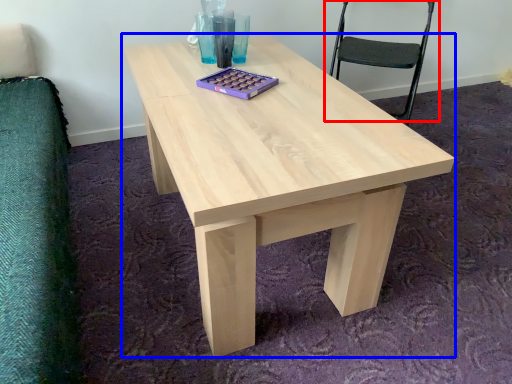
Question: Which object appears farthest to the camera in this image, chair (highlighted by a red box) or coffee table (highlighted by a blue box)?

Choices:
 (A) chair
 (B) coffee table

Answer: (A)